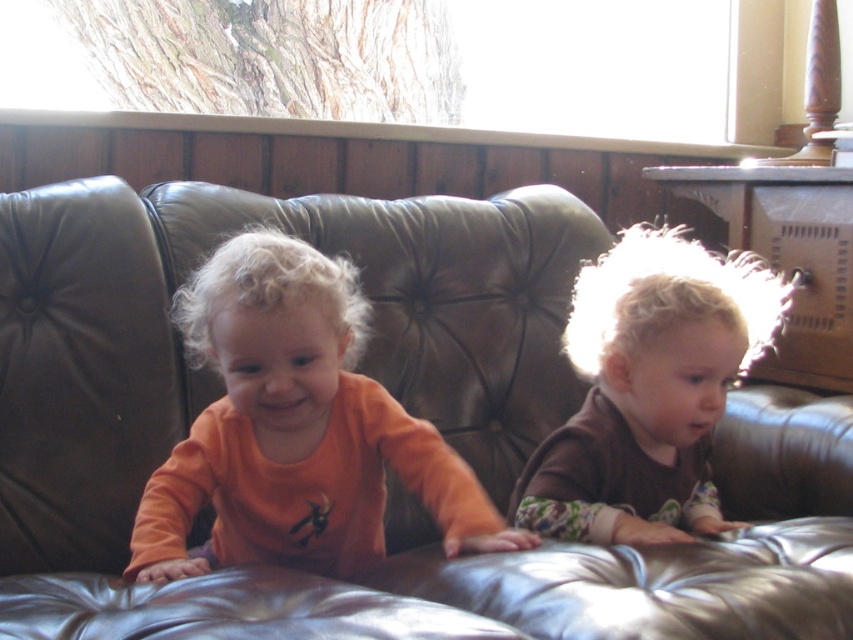
Does point (184, 371) lie behind point (358, 458)?

Yes, point (184, 371) is behind point (358, 458).

Which of these two, leather couch at center or orange soft fabric toddler at center, stands taller?

leather couch at center is taller.

Locate an element on the screen. leather couch at center is located at coordinates (399, 401).

Locate an element on the screen. Image resolution: width=853 pixels, height=640 pixels. leather couch at center is located at coordinates (399, 401).

Image resolution: width=853 pixels, height=640 pixels. What are the coordinates of `orange soft fabric toddler at center` in the screenshot? It's located at 296,429.

Locate an element on the screen. The width and height of the screenshot is (853, 640). orange soft fabric toddler at center is located at coordinates (296, 429).

Does leather couch at center come behind brown fuzzy sweater at right?

No.

Describe the element at coordinates (399, 401) in the screenshot. I see `leather couch at center` at that location.

Between point (521, 276) and point (607, 435), which one is positioned behind?

Point (521, 276)

Where is `leather couch at center`? Image resolution: width=853 pixels, height=640 pixels. leather couch at center is located at coordinates (399, 401).